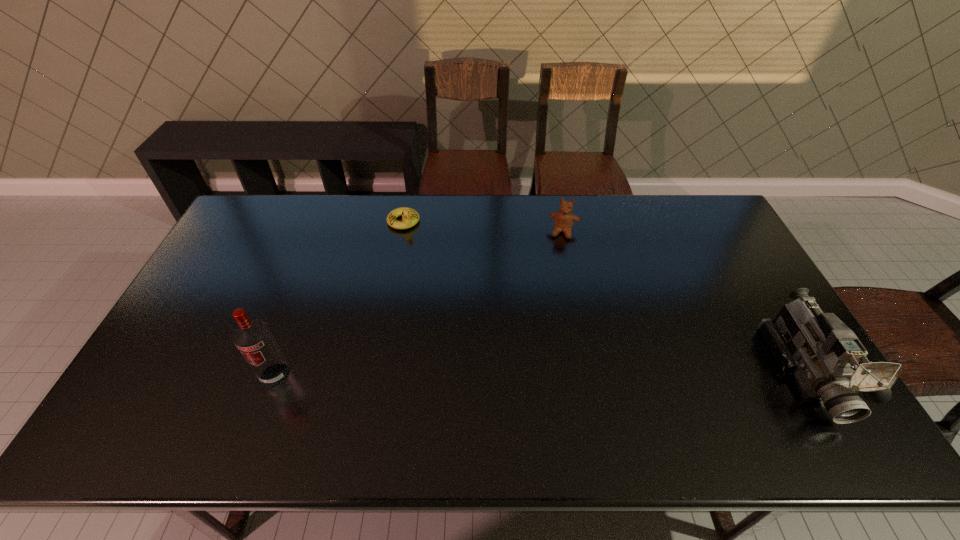
I want to click on object that is at the near right corner, so click(828, 360).

Locate an element on the screen. vacant point at the far edge is located at coordinates (636, 222).

The width and height of the screenshot is (960, 540). In the image, there is a desktop. What are the coordinates of `vacant space at the near edge` in the screenshot? It's located at (334, 383).

The width and height of the screenshot is (960, 540). I want to click on free space at the left edge of the desktop, so click(x=230, y=302).

The height and width of the screenshot is (540, 960). I want to click on vacant space at the right edge, so click(743, 335).

In the image, there is a desktop. Where is `blank space at the far left corner`? The height and width of the screenshot is (540, 960). blank space at the far left corner is located at coordinates (264, 207).

Where is `blank space at the near left corner of the desktop`? Image resolution: width=960 pixels, height=540 pixels. blank space at the near left corner of the desktop is located at coordinates click(x=184, y=404).

Image resolution: width=960 pixels, height=540 pixels. In the image, there is a desktop. Find the location of `vacant space at the far right corner`. vacant space at the far right corner is located at coordinates (712, 218).

Identify the location of free point between the tallest object and the third shortest object. (540, 373).

Where is `unoccupied position between the third object from left to right and the rightmost object`? The image size is (960, 540). unoccupied position between the third object from left to right and the rightmost object is located at coordinates (684, 301).